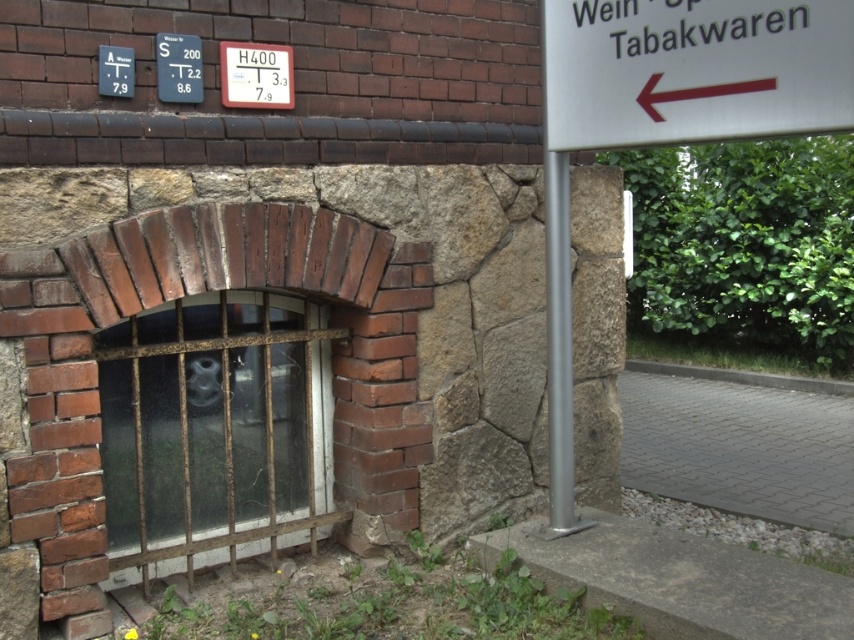
Question: Which point is farther from the camera taking this photo?

Choices:
 (A) (229, 86)
 (B) (161, 426)
 (C) (158, 65)
 (D) (110, 45)

Answer: (B)

Question: Is white plastic sign at upper center thinner than white plastic sign at upper left?

Choices:
 (A) yes
 (B) no

Answer: (B)

Question: Is white plastic sign at upper right further to camera compared to white plastic sign at upper left?

Choices:
 (A) no
 (B) yes

Answer: (A)

Question: Which point is farther to the camera?

Choices:
 (A) (197, 77)
 (B) (317, 518)

Answer: (B)

Question: Does white plastic sign at upper right appear under white plastic sign at upper left?

Choices:
 (A) yes
 (B) no

Answer: (A)

Question: Which of these objects is positioned farthest from the white plastic sign at upper center?

Choices:
 (A) rusty metal bars at center
 (B) white plastic sign at upper right
 (C) metallic blue sign at upper left

Answer: (B)